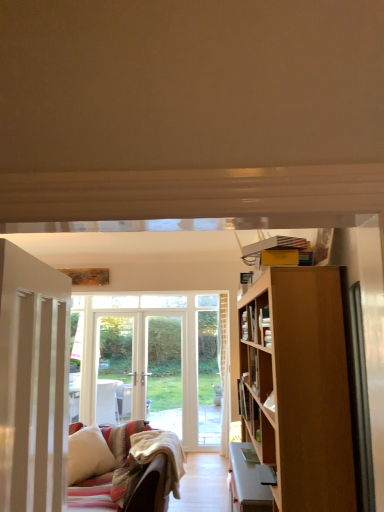
Question: From the image's perspective, is white wooden door at left above or below hardcover book at center?

Choices:
 (A) above
 (B) below

Answer: (A)

Question: Is white wooden door at left bigger or smaller than hardcover book at center?

Choices:
 (A) small
 (B) big

Answer: (B)

Question: Considering the real-world distances, which object is closest to the white wooden door at left?

Choices:
 (A) hardcover book at center
 (B) white soft pillow at lower left

Answer: (A)

Question: Which object is positioned closest to the white soft pillow at lower left?

Choices:
 (A) hardcover book at center
 (B) white wooden door at left

Answer: (A)